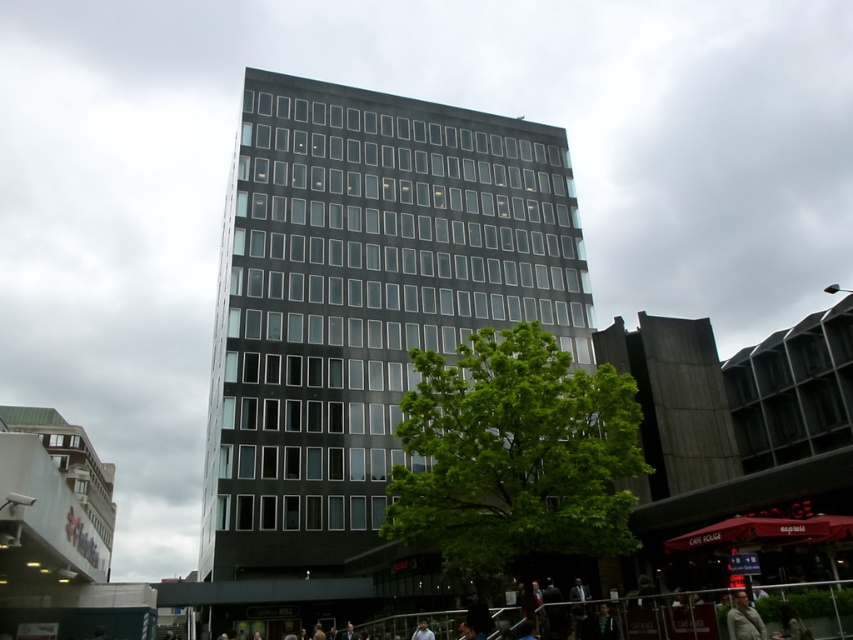
Is point (300, 364) positioned before point (752, 611)?

No, (300, 364) is behind (752, 611).

Does black glass building at center appear on the left side of green fabric jacket at lower right?

Yes, black glass building at center is to the left of green fabric jacket at lower right.

Find the location of `black glass building at center`. black glass building at center is located at coordinates (364, 308).

The image size is (853, 640). What are the coordinates of `black glass building at center` in the screenshot? It's located at (364, 308).